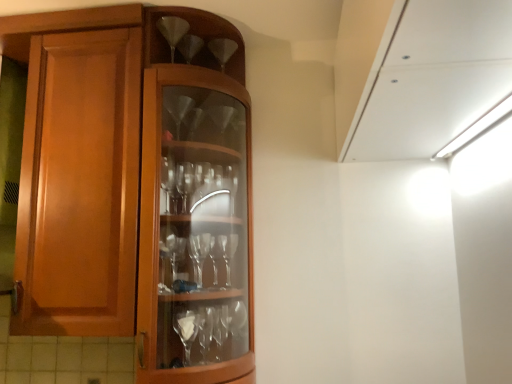
Question: Is clear glass wine glass at upper center, acting as the second wine glass starting from the front, wider or thinner than clear glass wine glass at upper center, placed as the 1th wine glass when sorted from left to right?

Choices:
 (A) wide
 (B) thin

Answer: (A)

Question: Is point (220, 56) positioned closer to the camera than point (181, 31)?

Choices:
 (A) farther
 (B) closer

Answer: (A)

Question: In terms of height, does clear glass wine glass at upper center, which ranks as the first wine glass in back-to-front order, look taller or shorter compared to clear glass wine glass at upper center, placed as the 1th wine glass when sorted from left to right?

Choices:
 (A) short
 (B) tall

Answer: (A)

Question: Considering the relative positions of clear glass wine glass at upper center, the first wine glass positioned from the front, and clear glass wine glass at upper center, which ranks as the first wine glass in back-to-front order, in the image provided, is clear glass wine glass at upper center, the first wine glass positioned from the front, to the left or to the right of clear glass wine glass at upper center, which ranks as the first wine glass in back-to-front order,?

Choices:
 (A) right
 (B) left

Answer: (B)

Question: Considering their positions, is clear glass wine glass at upper center, the first wine glass positioned from the front, located in front of or behind clear glass wine glass at upper center, which ranks as the first wine glass in back-to-front order?

Choices:
 (A) behind
 (B) front

Answer: (B)

Question: Is clear glass wine glass at upper center, which appears as the second wine glass when viewed from the right, wider or thinner than clear glass wine glass at upper center, acting as the second wine glass starting from the front?

Choices:
 (A) wide
 (B) thin

Answer: (B)

Question: In terms of height, does clear glass wine glass at upper center, placed as the 1th wine glass when sorted from left to right, look taller or shorter compared to clear glass wine glass at upper center, positioned as the second wine glass in left-to-right order?

Choices:
 (A) tall
 (B) short

Answer: (B)